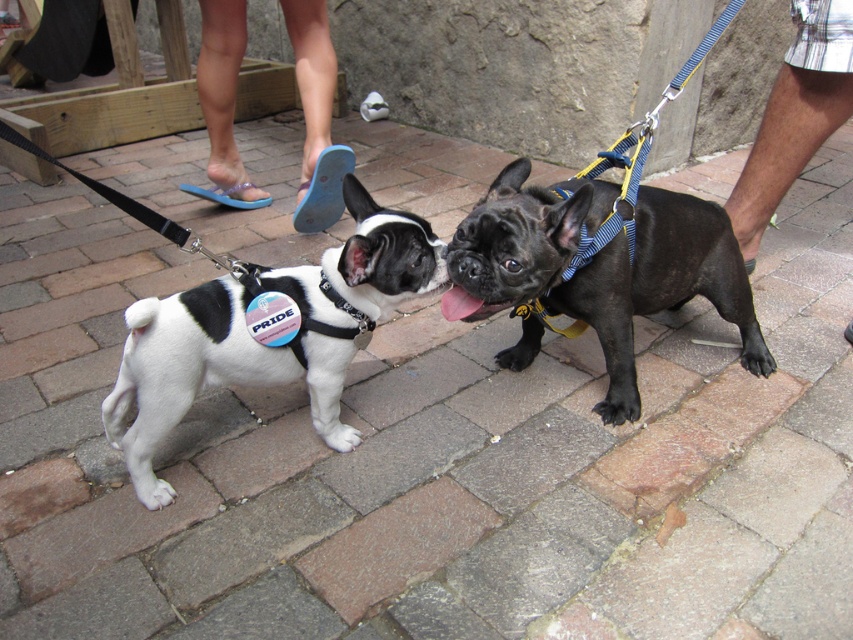
Is black matte french bulldog at center wider than white matte/black harness at left?

Yes.

Who is shorter, black matte french bulldog at center or white matte/black harness at left?

With less height is black matte french bulldog at center.

The width and height of the screenshot is (853, 640). I want to click on black matte french bulldog at center, so click(601, 268).